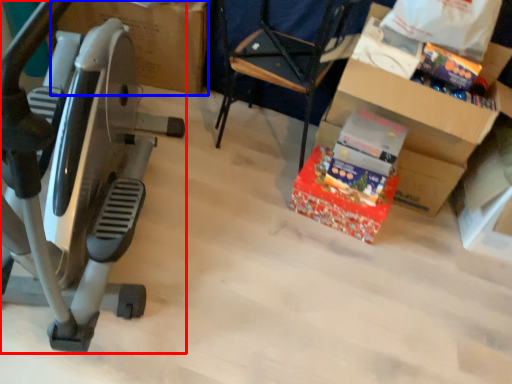
Question: Among these objects, which one is farthest to the camera, stationary bicycle (highlighted by a red box) or cardboard box (highlighted by a blue box)?

Choices:
 (A) stationary bicycle
 (B) cardboard box

Answer: (B)